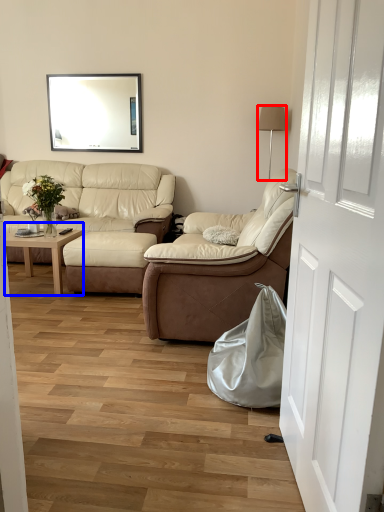
Question: Among these objects, which one is nearest to the camera, lamp (highlighted by a red box) or coffee table (highlighted by a blue box)?

Choices:
 (A) lamp
 (B) coffee table

Answer: (B)